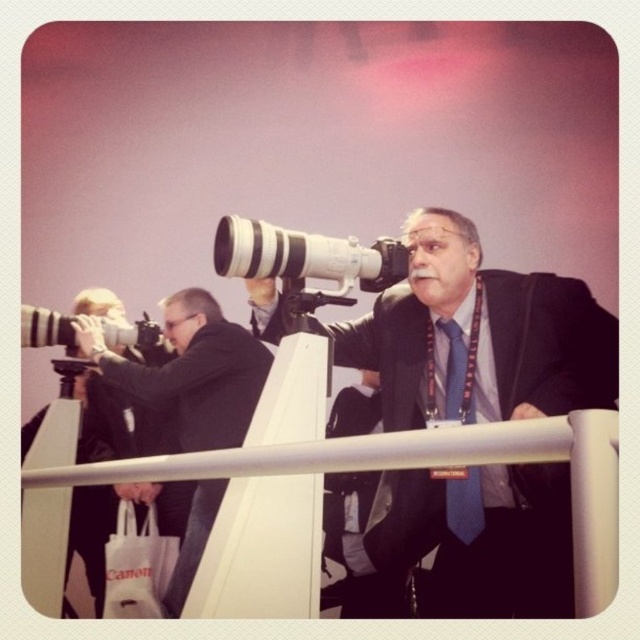
Question: Does matte black camera at center have a larger size compared to white plastic camera at center?

Choices:
 (A) yes
 (B) no

Answer: (A)

Question: Can you confirm if matte black camera at center is bigger than blue textured tie at center?

Choices:
 (A) no
 (B) yes

Answer: (B)

Question: Which of the following is the farthest from the observer?

Choices:
 (A) (356, 256)
 (B) (214, 456)
 (C) (481, 282)
 (D) (474, 472)

Answer: (C)

Question: Based on their relative distances, which object is nearer to the white metal rail at center?

Choices:
 (A) blue textured tie at center
 (B) white plastic camera at center

Answer: (B)

Question: Is the position of matte black camera at center less distant than that of white metal rail at center?

Choices:
 (A) yes
 (B) no

Answer: (B)

Question: Which point appears closest to the camera in this image?

Choices:
 (A) (333, 272)
 (B) (531, 474)

Answer: (B)